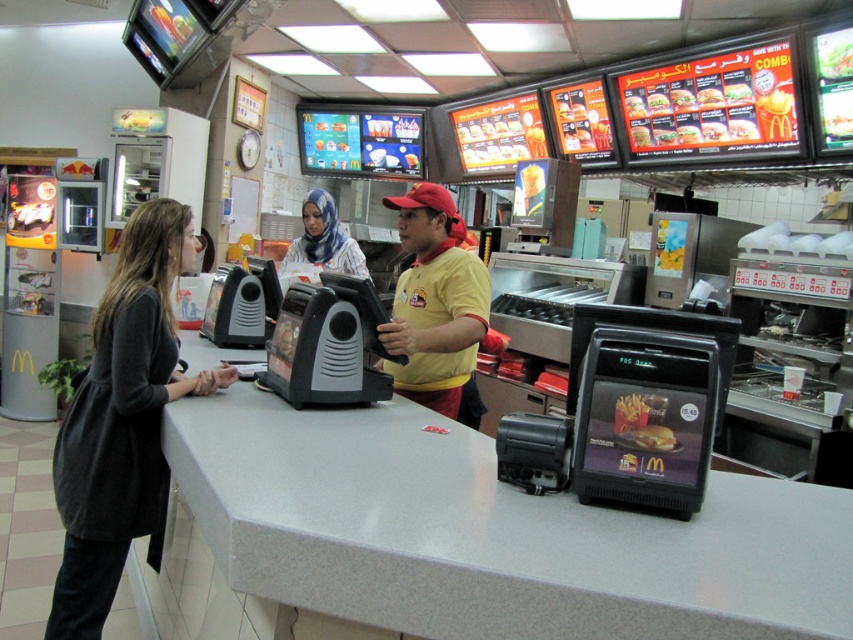
You are a customer at McDonalds and you see the yellow matte shirt at center and the golden crispy french fries at center on the counter. Which item is closer to the ceiling?

The yellow matte shirt at center is located above the golden crispy french fries at center, so it is closer to the ceiling.

You are a customer at the McDonalds counter. You see a yellow matte shirt at center and golden crispy french fries at center. Which item is larger in size?

The yellow matte shirt at center is bigger than golden crispy french fries at center.

You are a customer at the McDonalds counter and you see the dark gray sweater at left and the blue printed hijab at center. Which one is closer to the floor?

The dark gray sweater at left is located below the blue printed hijab at center, so it is closer to the floor.